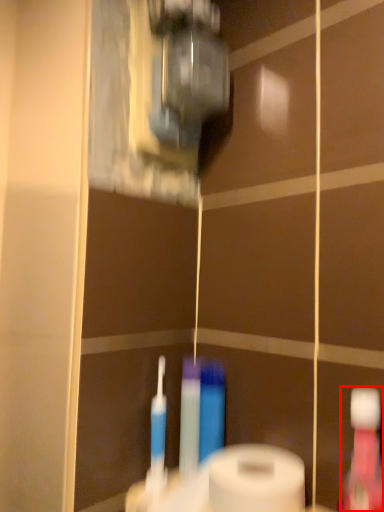
Question: From the image's perspective, where is mouthwash (annotated by the red box) located in relation to toilet paper in the image?

Choices:
 (A) below
 (B) above

Answer: (B)